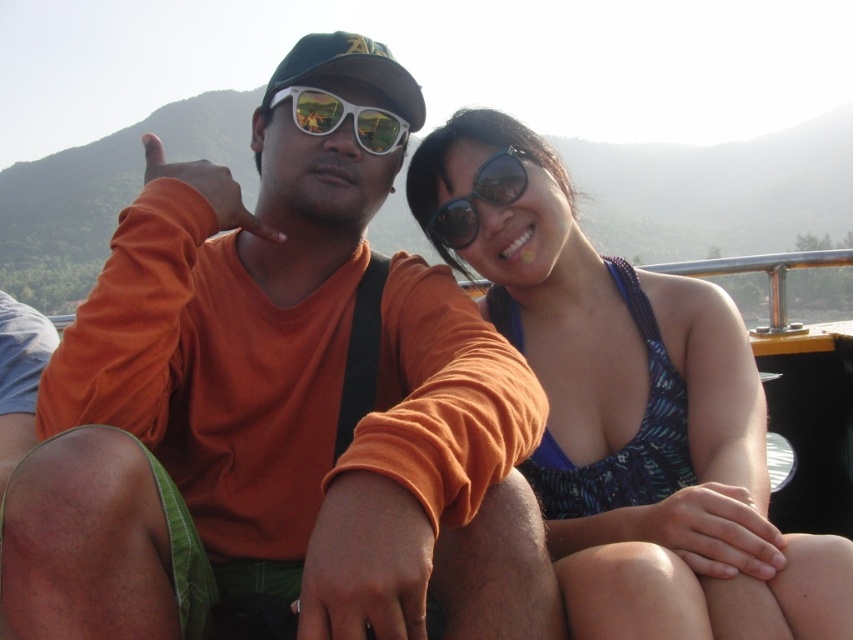
Which is behind, point (447, 237) or point (379, 129)?

Positioned behind is point (447, 237).

Who is higher up, sunglasses at center or white glossy sunglasses at center?

white glossy sunglasses at center

Does point (517, 156) come in front of point (289, 97)?

No, it is behind (289, 97).

You are a GUI agent. You are given a task and a screenshot of the screen. Output one action in this format:
    pyautogui.click(x=<x>, y=<y>)
    Task: Click on the sunglasses at center
    
    Given the screenshot: What is the action you would take?
    pyautogui.click(x=479, y=198)

Who is more distant from viewer, (402, 579) or (769, 589)?

The point (769, 589) is behind.

Between orange matte shirt at center and blue textured swimsuit at center, which one is positioned lower?

orange matte shirt at center is lower down.

Describe the element at coordinates (277, 410) in the screenshot. I see `orange matte shirt at center` at that location.

At what (x,y) coordinates should I click in order to perform the action: click on orange matte shirt at center. Please return your answer as a coordinate pair (x, y). This screenshot has width=853, height=640. Looking at the image, I should click on pos(277,410).

Does point (109, 499) lie in front of point (370, 134)?

Yes, point (109, 499) is closer to viewer.

Where is `orange matte shirt at center`? orange matte shirt at center is located at coordinates (277, 410).